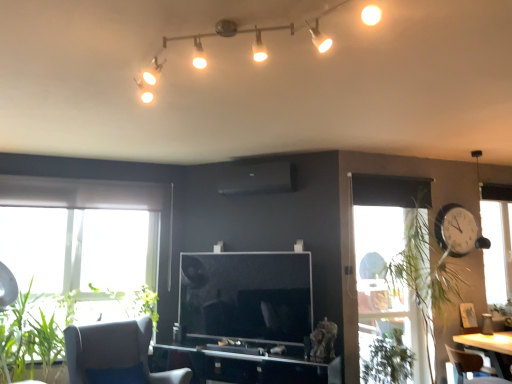
Question: Is point (441, 235) positioned closer to the camera than point (134, 357)?

Choices:
 (A) closer
 (B) farther

Answer: (B)

Question: From their relative heights in the image, would you say white plastic clock at right is taller or shorter than gray fabric chair at lower left, which appears as the first chair when viewed from the left?

Choices:
 (A) short
 (B) tall

Answer: (A)

Question: Which of these objects is positioned closest to the green leafy plant at lower right, placed as the third plant when sorted from left to right?

Choices:
 (A) matte white track lights at upper center
 (B) green leafy plant at lower left, which is the 3th plant from right to left
 (C) gray fabric chair at lower left, which appears as the first chair when viewed from the left
 (D) white plastic clock at right
 (E) transparent glass computer desk at center

Answer: (E)

Question: Estimate the real-world distances between objects in this image. Which object is farther from the green leafy plant at right, arranged as the first plant when viewed from the right?

Choices:
 (A) gray fabric chair at lower left, the 2th chair in the right-to-left sequence
 (B) transparent glass computer desk at center
 (C) green leafy plant at lower left, the 4th plant positioned from the right
 (D) green leafy plant at lower right, placed as the third plant when sorted from left to right
 (E) green leafy plant at lower left, which is the 3th plant from right to left

Answer: (C)